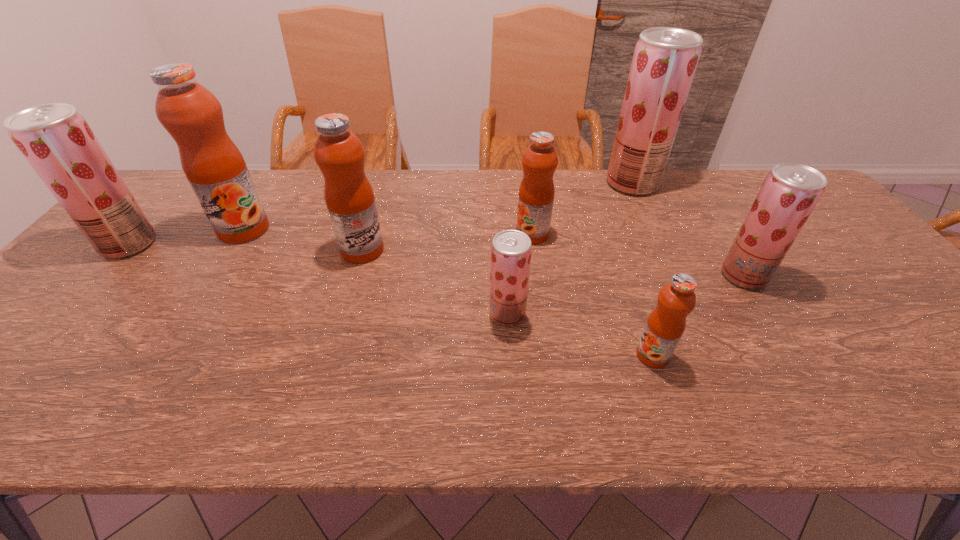
Identify which fruit juice is located as the seventh nearest to the farthest strawberry fruit juice. Please provide its 2D coordinates. Your answer should be formatted as a tuple, i.e. [(x, y)], where the tuple contains the x and y coordinates of a point satisfying the conditions above.

[(56, 140)]

Identify which fruit juice is located as the second nearest to the second strawberry fruit juice from right to left. Please provide its 2D coordinates. Your answer should be formatted as a tuple, i.e. [(x, y)], where the tuple contains the x and y coordinates of a point satisfying the conditions above.

[(790, 192)]

Point out which strawberry fruit juice is positioned as the second nearest to the leftmost fruit juice. Please provide its 2D coordinates. Your answer should be formatted as a tuple, i.e. [(x, y)], where the tuple contains the x and y coordinates of a point satisfying the conditions above.

[(665, 59)]

You are a GUI agent. You are given a task and a screenshot of the screen. Output one action in this format:
    pyautogui.click(x=<x>, y=<y>)
    Task: Click on the strawberry fruit juice identified as the third closest to the biggest strawberry fruit juice
    
    Given the screenshot: What is the action you would take?
    pyautogui.click(x=56, y=140)

Identify which orange fruit juice is located as the second nearest to the third fruit juice from left to right. Please provide its 2D coordinates. Your answer should be formatted as a tuple, i.e. [(x, y)], where the tuple contains the x and y coordinates of a point satisfying the conditions above.

[(536, 194)]

Identify the location of orange fruit juice that is the third closest to the seventh object from right to left. This screenshot has height=540, width=960. (665, 326).

At what (x,y) coordinates should I click in order to perform the action: click on free spot that satisfies the following two spatial constraints: 1. on the front label of the rightmost fruit juice; 2. on the right side of the second smallest orange fruit juice. Please return your answer as a coordinate pair (x, y). The width and height of the screenshot is (960, 540). Looking at the image, I should click on (538, 275).

What are the coordinates of `vacant space that satisfies the following two spatial constraints: 1. on the front side of the farthest fruit juice; 2. on the front label of the third orange fruit juice from left to right` in the screenshot? It's located at (656, 234).

In order to click on vacant space that satisfies the following two spatial constraints: 1. on the front label of the rightmost object; 2. on the left side of the third biggest orange fruit juice in this screenshot , I will do `click(538, 275)`.

Where is `vacant space that satisfies the following two spatial constraints: 1. on the back side of the second nearest fruit juice; 2. on the left side of the third biggest strawberry fruit juice`? The height and width of the screenshot is (540, 960). vacant space that satisfies the following two spatial constraints: 1. on the back side of the second nearest fruit juice; 2. on the left side of the third biggest strawberry fruit juice is located at coordinates (505, 275).